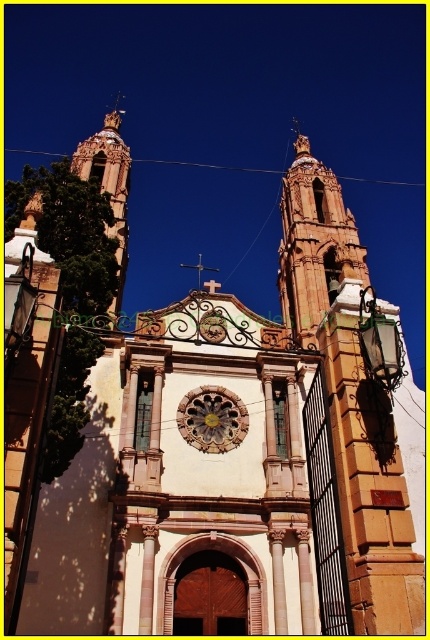
Can you confirm if golden stone clock at center is wider than gold metallic clock at center?

Yes, golden stone clock at center is wider than gold metallic clock at center.

Between point (187, 426) and point (208, 317), which one is positioned in front?

Point (187, 426) is more forward.

Identify the location of golden stone clock at center. Image resolution: width=430 pixels, height=640 pixels. (211, 419).

Measure the distance between smooth terracotta bell tower at upper center and camera.

smooth terracotta bell tower at upper center is 35.50 meters from camera.

Who is shorter, smooth terracotta bell tower at upper center or gold metallic clock at center?

gold metallic clock at center

Who is more distant from viewer, [316,189] or [200,323]?

Point [316,189]

The width and height of the screenshot is (430, 640). What are the coordinates of `smooth terracotta bell tower at upper center` in the screenshot? It's located at (313, 243).

Is smooth terracotta bell tower at upper center below golden stone clock at center?

No, smooth terracotta bell tower at upper center is not below golden stone clock at center.

This screenshot has height=640, width=430. In order to click on smooth terracotta bell tower at upper center in this screenshot , I will do `click(313, 243)`.

The width and height of the screenshot is (430, 640). In order to click on smooth terracotta bell tower at upper center in this screenshot , I will do `click(313, 243)`.